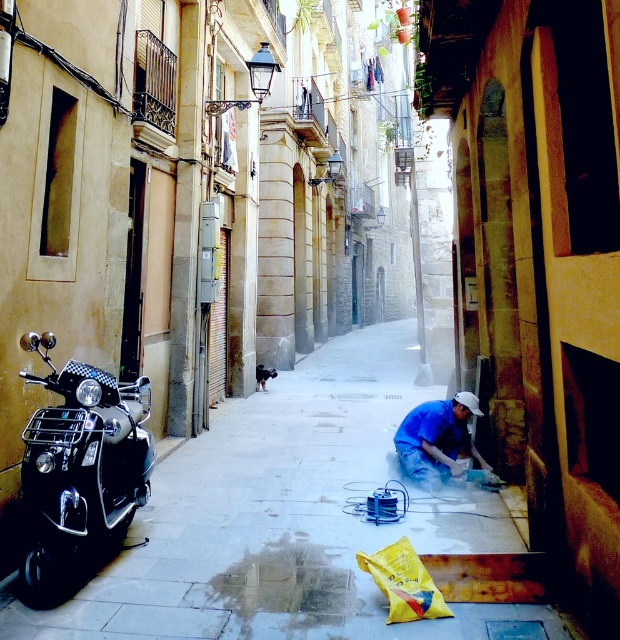
Question: Which of the following is the closest to the observer?

Choices:
 (A) smooth concrete pavement at center
 (B) blue fabric at lower right

Answer: (A)

Question: Does smooth concrete pavement at center have a lesser width compared to shiny black scooter at left?

Choices:
 (A) no
 (B) yes

Answer: (A)

Question: Is smooth concrete pavement at center further to camera compared to blue fabric at lower right?

Choices:
 (A) no
 (B) yes

Answer: (A)

Question: Can you confirm if smooth concrete pavement at center is smaller than blue fabric at lower right?

Choices:
 (A) no
 (B) yes

Answer: (A)

Question: Which point appears closest to the camera in this image?

Choices:
 (A) (x=37, y=344)
 (B) (x=430, y=436)

Answer: (A)

Question: Considering the real-world distances, which object is closest to the shiny black scooter at left?

Choices:
 (A) blue fabric at lower right
 (B) smooth concrete pavement at center

Answer: (B)